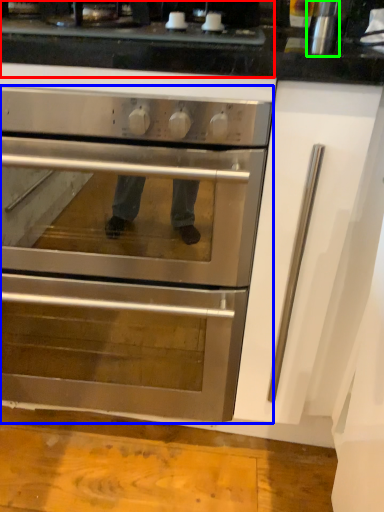
Question: Which object is the farthest from gas stove (highlighted by a red box)? Choose among these: oven (highlighted by a blue box) or appliance (highlighted by a green box).

Choices:
 (A) oven
 (B) appliance

Answer: (A)